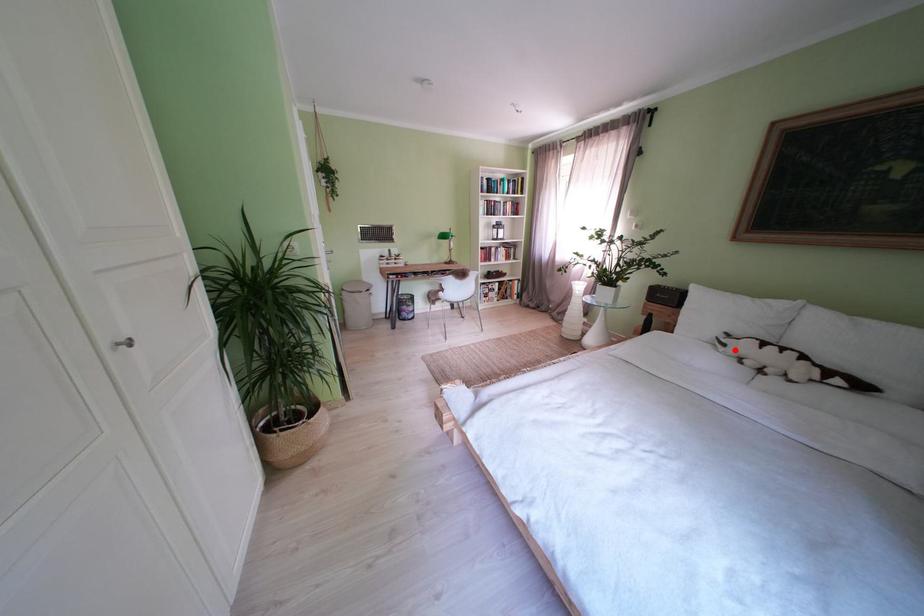
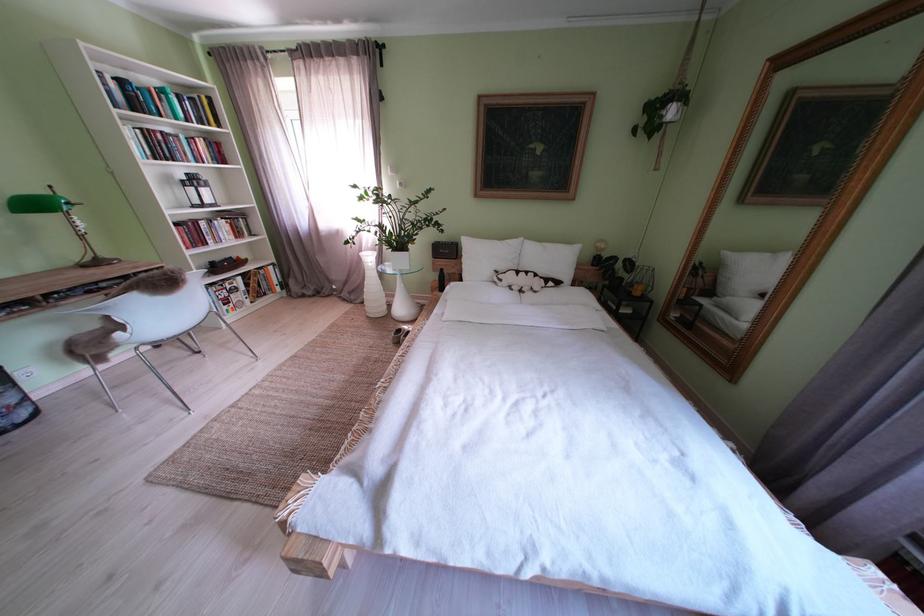
The point at the highlighted location is marked in the first image. Where is the corresponding point in the second image?

(512, 285)